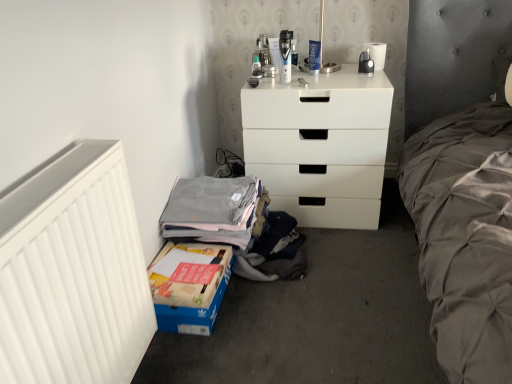
I want to click on free space above white matte radiator at left (from a real-world perspective), so click(x=48, y=184).